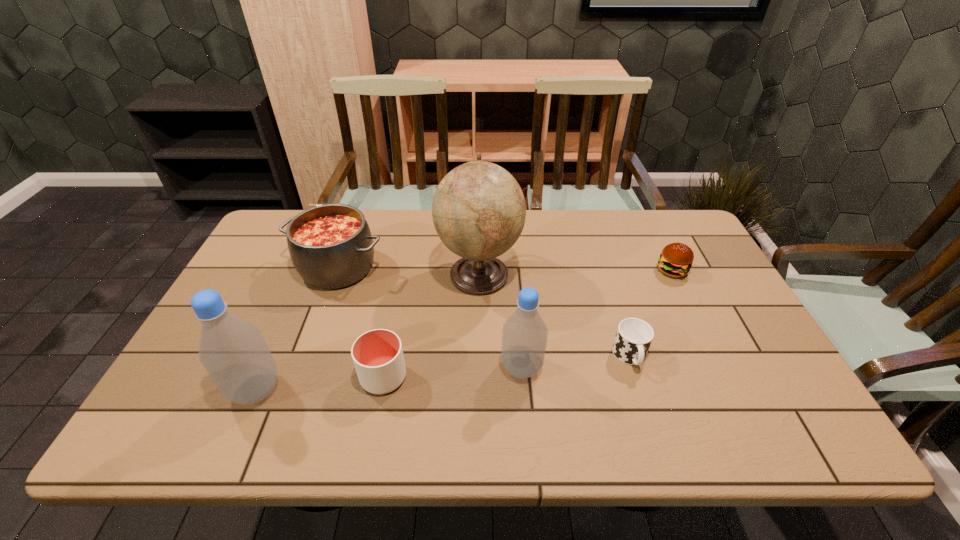
Find the location of a particular element. This screenshot has height=540, width=960. free space that is in between the fourth shortest object and the tallest object is located at coordinates (409, 271).

The image size is (960, 540). Find the location of `vacant area that lies between the globe and the fifth shortest object`. vacant area that lies between the globe and the fifth shortest object is located at coordinates (500, 321).

At what (x,y) coordinates should I click in order to perform the action: click on vacant space in between the taller cup and the fourth shortest object. Please return your answer as a coordinate pair (x, y). The height and width of the screenshot is (540, 960). Looking at the image, I should click on (361, 322).

I want to click on free spot between the shorter cup and the casserole, so click(484, 312).

This screenshot has width=960, height=540. Identify the location of empty space that is in between the hamburger and the taller bottle. (464, 330).

The height and width of the screenshot is (540, 960). In order to click on vacant region between the right cup and the fourth tallest object in this screenshot , I will do `click(484, 312)`.

Find the location of a particular element. The width and height of the screenshot is (960, 540). vacant area between the casserole and the taller bottle is located at coordinates (297, 328).

Identify which object is located as the nearest to the tallest object. Please provide its 2D coordinates. Your answer should be formatted as a tuple, i.e. [(x, y)], where the tuple contains the x and y coordinates of a point satisfying the conditions above.

[(524, 336)]

Locate which object ranks sixth in proximity to the right bottle. Please provide its 2D coordinates. Your answer should be formatted as a tuple, i.e. [(x, y)], where the tuple contains the x and y coordinates of a point satisfying the conditions above.

[(233, 351)]

Where is `free spot that satisfies the following two spatial constraints: 1. on the back side of the taller bottle; 2. on the right side of the taller cup`? free spot that satisfies the following two spatial constraints: 1. on the back side of the taller bottle; 2. on the right side of the taller cup is located at coordinates (261, 377).